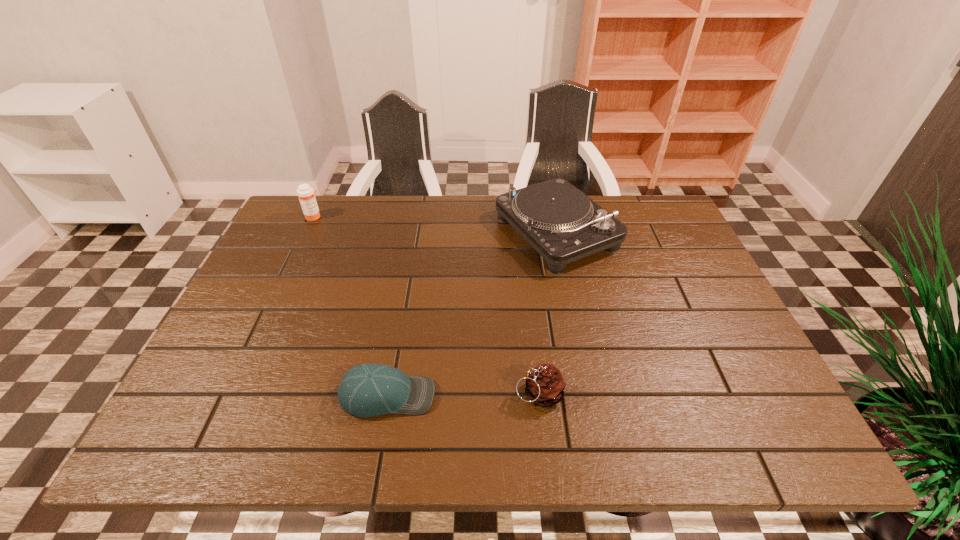
The height and width of the screenshot is (540, 960). In order to click on free location at the right edge of the desktop in this screenshot , I will do `click(700, 371)`.

Where is `vacant space at the far left corner of the desktop`? vacant space at the far left corner of the desktop is located at coordinates (300, 226).

In the image, there is a desktop. Where is `free space at the near left corner`? free space at the near left corner is located at coordinates (220, 431).

Find the location of `vacant area that lies between the baseball cap and the record player`. vacant area that lies between the baseball cap and the record player is located at coordinates (472, 314).

This screenshot has width=960, height=540. What are the coordinates of `empty location between the second object from left to right and the leftmost object` in the screenshot? It's located at (350, 306).

Identify the location of empty space that is in between the third tallest object and the record player. (547, 313).

Image resolution: width=960 pixels, height=540 pixels. What are the coordinates of `free space between the baseball cap and the record player` in the screenshot? It's located at (472, 314).

Identify the location of free space between the shortest object and the medicine. The height and width of the screenshot is (540, 960). (350, 306).

What are the coordinates of `vacant area that lies between the medicine and the record player` in the screenshot? It's located at (x=435, y=225).

Where is `vacant region between the second object from left to right and the record player`? Image resolution: width=960 pixels, height=540 pixels. vacant region between the second object from left to right and the record player is located at coordinates (472, 314).